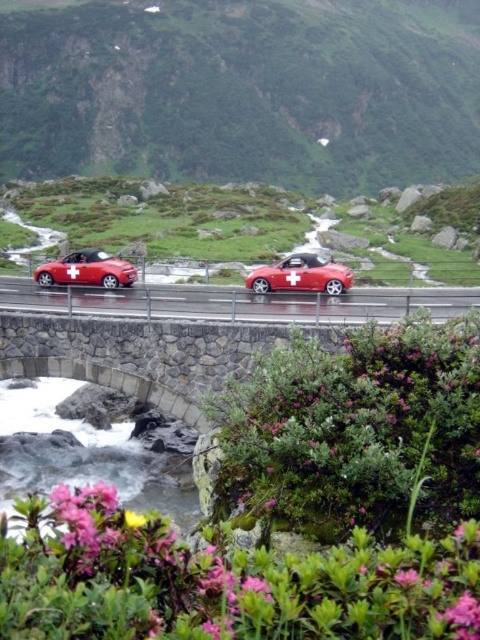
Describe the element at coordinates (300, 275) in the screenshot. I see `metallic red convertible at center` at that location.

Is metallic red convertible at center positioned behind shiny red convertible at left?

No, it is not.

Image resolution: width=480 pixels, height=640 pixels. What do you see at coordinates (300, 275) in the screenshot? I see `metallic red convertible at center` at bounding box center [300, 275].

At what (x,y) coordinates should I click in order to perform the action: click on metallic red convertible at center. Please return your answer as a coordinate pair (x, y). Looking at the image, I should click on pyautogui.click(x=300, y=275).

Consider the image. Which is more to the left, white smooth water at center or metallic red convertible at center?

white smooth water at center

Is white smooth water at center thinner than metallic red convertible at center?

In fact, white smooth water at center might be wider than metallic red convertible at center.

What do you see at coordinates (84, 454) in the screenshot? The image size is (480, 640). I see `white smooth water at center` at bounding box center [84, 454].

Locate an element on the screen. The height and width of the screenshot is (640, 480). white smooth water at center is located at coordinates (84, 454).

Can you confirm if metallic red convertible at center is bigger than smooth yellow flower at lower left?

Actually, metallic red convertible at center might be smaller than smooth yellow flower at lower left.

Looking at this image, which is below, metallic red convertible at center or smooth yellow flower at lower left?

Positioned lower is smooth yellow flower at lower left.

Where is `metallic red convertible at center`? metallic red convertible at center is located at coordinates (300, 275).